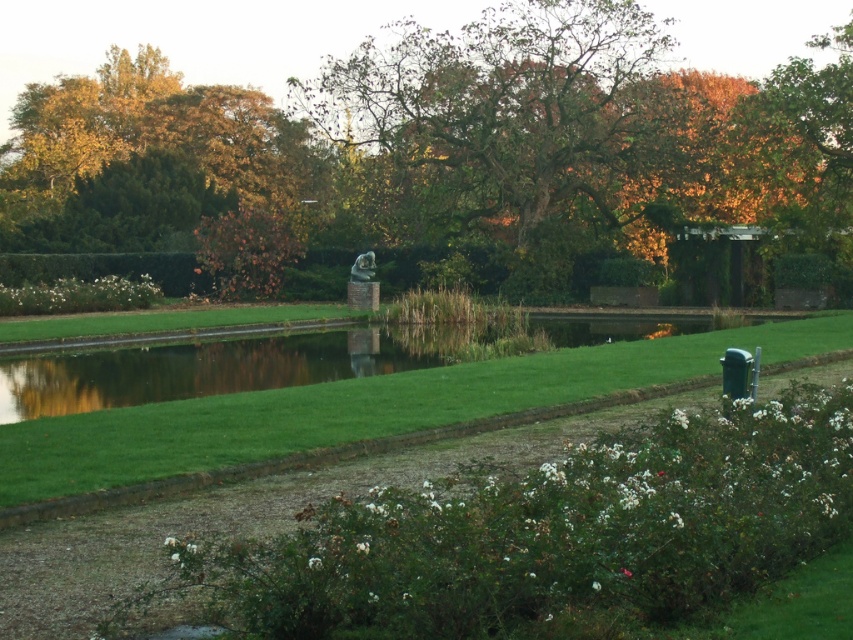
The width and height of the screenshot is (853, 640). What do you see at coordinates (491, 116) in the screenshot? I see `green leafy tree at center` at bounding box center [491, 116].

Is green leafy tree at center to the right of golden foliage at upper left from the viewer's perspective?

Yes, green leafy tree at center is to the right of golden foliage at upper left.

Is point (425, 209) positioned in front of point (184, 124)?

Yes, it is in front of point (184, 124).

Locate an element on the screen. The width and height of the screenshot is (853, 640). green leafy tree at center is located at coordinates (491, 116).

Can you confirm if green leafy tree at center is wider than green grass at center?

Indeed, green leafy tree at center has a greater width compared to green grass at center.

Is point (512, 36) farther from camera compared to point (103, 410)?

Yes, it is.

Find the location of a particular element. The width and height of the screenshot is (853, 640). green leafy tree at center is located at coordinates (491, 116).

Measure the distance between green grass at center and golden foliage at upper left.

→ The distance of green grass at center from golden foliage at upper left is 184.79 feet.

Looking at this image, who is taller, green grass at center or golden foliage at upper left?

golden foliage at upper left

What do you see at coordinates (360, 406) in the screenshot? The height and width of the screenshot is (640, 853). I see `green grass at center` at bounding box center [360, 406].

Locate an element on the screen. The width and height of the screenshot is (853, 640). green grass at center is located at coordinates (360, 406).